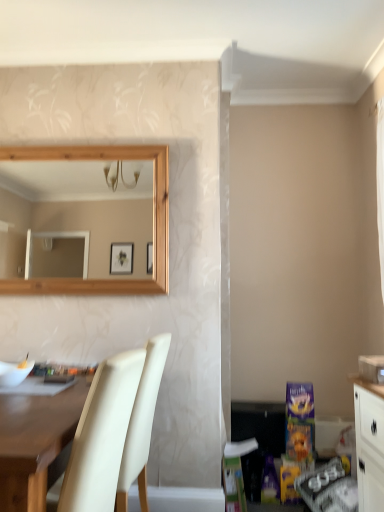
Question: Is matte white desk at lower left surrounded by cream leather chair at lower left?

Choices:
 (A) yes
 (B) no

Answer: (B)

Question: From a real-world perspective, is cream leather chair at lower left physically below matte white desk at lower left?

Choices:
 (A) no
 (B) yes

Answer: (A)

Question: Is matte white desk at lower left at the back of cream leather chair at lower left?

Choices:
 (A) no
 (B) yes

Answer: (B)

Question: From a real-world perspective, is cream leather chair at lower left over matte white desk at lower left?

Choices:
 (A) no
 (B) yes

Answer: (B)

Question: From the image's perspective, would you say cream leather chair at lower left is shown under matte white desk at lower left?

Choices:
 (A) no
 (B) yes

Answer: (A)

Question: Does cream leather chair at lower left have a lesser width compared to matte white desk at lower left?

Choices:
 (A) yes
 (B) no

Answer: (A)

Question: Is matte white desk at lower left at the right side of cream leather chair at lower left?

Choices:
 (A) yes
 (B) no

Answer: (B)

Question: Is matte white desk at lower left looking in the opposite direction of cream leather chair at lower left?

Choices:
 (A) yes
 (B) no

Answer: (A)

Question: From the image's perspective, would you say matte white desk at lower left is shown under cream leather chair at lower left?

Choices:
 (A) yes
 (B) no

Answer: (A)

Question: Considering the relative sizes of matte white desk at lower left and cream leather chair at lower left in the image provided, is matte white desk at lower left taller than cream leather chair at lower left?

Choices:
 (A) yes
 (B) no

Answer: (B)

Question: Could you tell me if matte white desk at lower left is turned towards cream leather chair at lower left?

Choices:
 (A) no
 (B) yes

Answer: (A)

Question: Does matte white desk at lower left have a lesser height compared to cream leather chair at lower left?

Choices:
 (A) yes
 (B) no

Answer: (A)

Question: Based on their sizes in the image, would you say matte white desk at lower left is bigger or smaller than cream leather chair at lower left?

Choices:
 (A) small
 (B) big

Answer: (B)